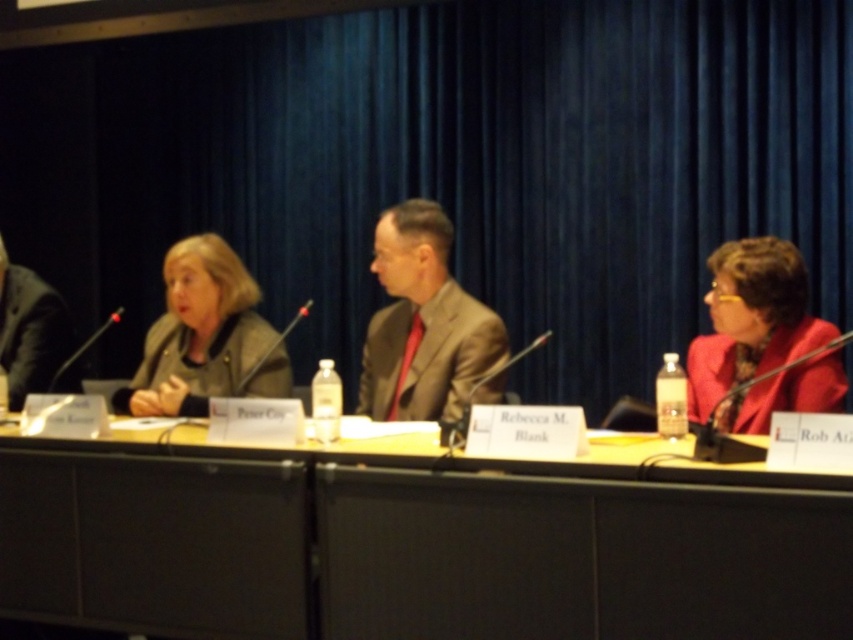
You are organizing a small event and need to seat a guest wearing a matte brown suit at center. The venue has a yellow wood table at center that is larger than the suit. Will the table be big enough to accommodate the guest comfortably?

The yellow wood table at center has a larger size compared to the matte brown suit at center, so it will be big enough to accommodate the guest comfortably.

You are organizing a photo shoot and need to arrange two suits for a catalog. The matte brown suit at center and the black suit at left are available. Which suit should you choose if you want the one that is taller?

The matte brown suit at center is taller than the black suit at left, so you should choose the matte brown suit at center.